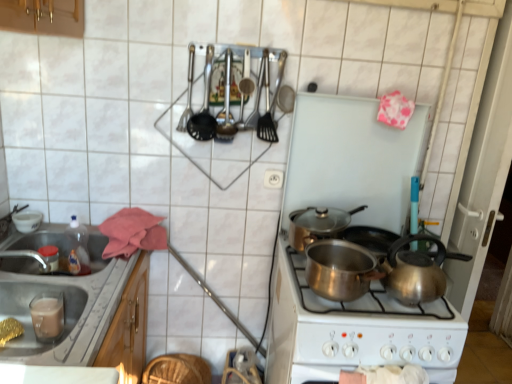
At what (x,y) coordinates should I click in order to perform the action: click on golden textured bread at lower left. Please return your answer as a coordinate pair (x, y). Looking at the image, I should click on (9, 330).

Image resolution: width=512 pixels, height=384 pixels. What do you see at coordinates (65, 306) in the screenshot?
I see `metallic stainless steel sink at lower left` at bounding box center [65, 306].

Measure the distance between metallic stainless steel sink at lower left and camera.

metallic stainless steel sink at lower left and camera are 1.02 meters apart.

At what (x,y) coordinates should I click in order to perform the action: click on golden textured bread at lower left. Please return your answer as a coordinate pair (x, y). Looking at the image, I should click on (9, 330).

In the image, is shiny silver pot at center, the 2th kitchen appliance when ordered from front to back, positioned in front of or behind satin silver pot at center, arranged as the 1th kitchen appliance when ordered from the bottom?

In the image, shiny silver pot at center, the 2th kitchen appliance when ordered from front to back, appears behind satin silver pot at center, arranged as the 1th kitchen appliance when ordered from the bottom.

From a real-world perspective, which is physically above, shiny silver pot at center, the second kitchen appliance when ordered from bottom to top, or satin silver pot at center, which appears as the second kitchen appliance when viewed from the back?

shiny silver pot at center, the second kitchen appliance when ordered from bottom to top, is physically above.

I want to click on kitchen appliance lying in front of the shiny silver pot at center, the 2th kitchen appliance when ordered from front to back, so click(x=340, y=269).

Based on their positions, is shiny silver pot at center, the first kitchen appliance viewed from the back, located to the left or right of satin silver pot at center, the 2th kitchen appliance from the top?

Based on their positions, shiny silver pot at center, the first kitchen appliance viewed from the back, is located to the right of satin silver pot at center, the 2th kitchen appliance from the top.

Is satin silver pot at center, the 2th kitchen appliance from the top, beside shiny silver pot at center, the 2th kitchen appliance when ordered from front to back?

No, satin silver pot at center, the 2th kitchen appliance from the top, is not making contact with shiny silver pot at center, the 2th kitchen appliance when ordered from front to back.

Locate an element on the screen. kitchen appliance located behind the satin silver pot at center, arranged as the 1th kitchen appliance when ordered from the bottom is located at coordinates (317, 224).

Which object is positioned more to the left, satin silver pot at center, arranged as the 1th kitchen appliance when ordered from the bottom, or shiny silver pot at center, the first kitchen appliance viewed from the back?

Positioned to the left is satin silver pot at center, arranged as the 1th kitchen appliance when ordered from the bottom.

Considering the sizes of objects satin silver pot at center, the 2th kitchen appliance from the top, and shiny silver pot at center, the first kitchen appliance viewed from the back, in the image provided, who is bigger, satin silver pot at center, the 2th kitchen appliance from the top, or shiny silver pot at center, the first kitchen appliance viewed from the back,?

→ satin silver pot at center, the 2th kitchen appliance from the top, is bigger.

Is satin silver pot at center, which appears as the second kitchen appliance when viewed from the back, not within white plastic electric outlet at center?

That's correct, satin silver pot at center, which appears as the second kitchen appliance when viewed from the back, is outside of white plastic electric outlet at center.

From the image's perspective, starting from the white plastic electric outlet at center, which kitchen appliance is the 2nd one below? Please provide its 2D coordinates.

[(340, 269)]

Is satin silver pot at center, arranged as the 1th kitchen appliance when ordered from the bottom, in contact with white plastic electric outlet at center?

satin silver pot at center, arranged as the 1th kitchen appliance when ordered from the bottom, is not next to white plastic electric outlet at center, and they're not touching.

Is shiny silver pot at center, the first kitchen appliance when ordered from top to bottom, positioned far away from metallic stainless steel sink at lower left?

No.

How different are the orientations of shiny silver pot at center, the 2th kitchen appliance when ordered from front to back, and metallic stainless steel sink at lower left in degrees?

The angle between the facing direction of shiny silver pot at center, the 2th kitchen appliance when ordered from front to back, and the facing direction of metallic stainless steel sink at lower left is 89.1 degrees.

From a real-world perspective, who is located lower, shiny silver pot at center, the first kitchen appliance viewed from the back, or metallic stainless steel sink at lower left?

metallic stainless steel sink at lower left is physically lower.

Which is less distant, (303, 209) or (62, 336)?

Point (303, 209) is farther from the camera than point (62, 336).

Considering the sizes of objects shiny metallic kettle at center right and white plastic electric outlet at center in the image provided, who is shorter, shiny metallic kettle at center right or white plastic electric outlet at center?

Standing shorter between the two is white plastic electric outlet at center.

Is white plastic electric outlet at center surrounded by shiny metallic kettle at center right?

Definitely not — white plastic electric outlet at center is not inside shiny metallic kettle at center right.

Considering the sizes of shiny metallic kettle at center right and white plastic electric outlet at center in the image, is shiny metallic kettle at center right bigger or smaller than white plastic electric outlet at center?

Clearly, shiny metallic kettle at center right is larger in size than white plastic electric outlet at center.

Is shiny metallic kettle at center right facing towards white plastic electric outlet at center?

No, shiny metallic kettle at center right is not aimed at white plastic electric outlet at center.

Is golden textured bread at lower left positioned far away from satin silver pot at center, which appears as the second kitchen appliance when viewed from the back?

They are positioned close to each other.

Considering the sizes of objects golden textured bread at lower left and satin silver pot at center, the 2th kitchen appliance from the top, in the image provided, who is thinner, golden textured bread at lower left or satin silver pot at center, the 2th kitchen appliance from the top,?

golden textured bread at lower left is thinner.

From a real-world perspective, is golden textured bread at lower left positioned above or below satin silver pot at center, which appears as the second kitchen appliance when viewed from the back?

golden textured bread at lower left is situated lower than satin silver pot at center, which appears as the second kitchen appliance when viewed from the back, in the real world.

Considering the sizes of objects golden textured bread at lower left and satin silver pot at center, which appears as the 1th kitchen appliance when viewed from the front, in the image provided, who is bigger, golden textured bread at lower left or satin silver pot at center, which appears as the 1th kitchen appliance when viewed from the front,?

satin silver pot at center, which appears as the 1th kitchen appliance when viewed from the front.

Which of these two, metallic stainless steel sink at lower left or shiny metallic kettle at center right, stands shorter?

shiny metallic kettle at center right.

In the image, is metallic stainless steel sink at lower left positioned in front of or behind shiny metallic kettle at center right?

Visually, metallic stainless steel sink at lower left is located in front of shiny metallic kettle at center right.

Between metallic stainless steel sink at lower left and shiny metallic kettle at center right, which one has larger size?

metallic stainless steel sink at lower left.

Find the location of a particular element. kitchen appliance in front of the shiny silver pot at center, the second kitchen appliance when ordered from bottom to top is located at coordinates (340, 269).

I want to click on kitchen appliance on the right of satin silver pot at center, arranged as the 1th kitchen appliance when ordered from the bottom, so click(317, 224).

Looking at the image, which one is located closer to white plastic electric outlet at center, shiny silver pot at center, the first kitchen appliance viewed from the back, or satin silver pot at center, which appears as the second kitchen appliance when viewed from the back?

The object closer to white plastic electric outlet at center is shiny silver pot at center, the first kitchen appliance viewed from the back.

Considering their positions, is shiny metallic kettle at center right positioned further to shiny silver pot at center, the 2th kitchen appliance when ordered from front to back, than satin silver pot at center, arranged as the 1th kitchen appliance when ordered from the bottom?

shiny metallic kettle at center right is positioned further to the anchor shiny silver pot at center, the 2th kitchen appliance when ordered from front to back.

Based on the photo, when comparing their distances from golden textured bread at lower left, does metallic stainless steel sink at lower left or satin silver pot at center, which appears as the 1th kitchen appliance when viewed from the front, seem further?

The object further to golden textured bread at lower left is satin silver pot at center, which appears as the 1th kitchen appliance when viewed from the front.

Based on their spatial positions, is shiny metallic kettle at center right or metallic stainless steel sink at lower left further from shiny silver pot at center, the 2th kitchen appliance when ordered from front to back?

Among the two, metallic stainless steel sink at lower left is located further to shiny silver pot at center, the 2th kitchen appliance when ordered from front to back.

When comparing their distances from golden textured bread at lower left, does shiny metallic kettle at center right or shiny silver pot at center, the first kitchen appliance viewed from the back, seem further?

Based on the image, shiny metallic kettle at center right appears to be further to golden textured bread at lower left.

From the image, which object appears to be nearer to shiny silver pot at center, the first kitchen appliance viewed from the back, satin silver pot at center, which appears as the 1th kitchen appliance when viewed from the front, or metallic stainless steel sink at lower left?

satin silver pot at center, which appears as the 1th kitchen appliance when viewed from the front, is closer to shiny silver pot at center, the first kitchen appliance viewed from the back.

When comparing their distances from shiny silver pot at center, the first kitchen appliance when ordered from top to bottom, does metallic stainless steel sink at lower left or golden textured bread at lower left seem closer?

metallic stainless steel sink at lower left lies closer to shiny silver pot at center, the first kitchen appliance when ordered from top to bottom, than the other object.

Which object lies further to the anchor point shiny metallic kettle at center right, golden textured bread at lower left or white plastic electric outlet at center?

golden textured bread at lower left.

The width and height of the screenshot is (512, 384). What are the coordinates of `electric outlet between golden textured bread at lower left and shiny metallic kettle at center right from left to right` in the screenshot? It's located at (273, 179).

The width and height of the screenshot is (512, 384). I want to click on kitchen appliance between satin silver pot at center, arranged as the 1th kitchen appliance when ordered from the bottom, and shiny metallic kettle at center right, in the horizontal direction, so click(x=317, y=224).

Identify the location of sink between golden textured bread at lower left and satin silver pot at center, arranged as the 1th kitchen appliance when ordered from the bottom, from left to right. (65, 306).

I want to click on sink between golden textured bread at lower left and white plastic electric outlet at center, so click(65, 306).